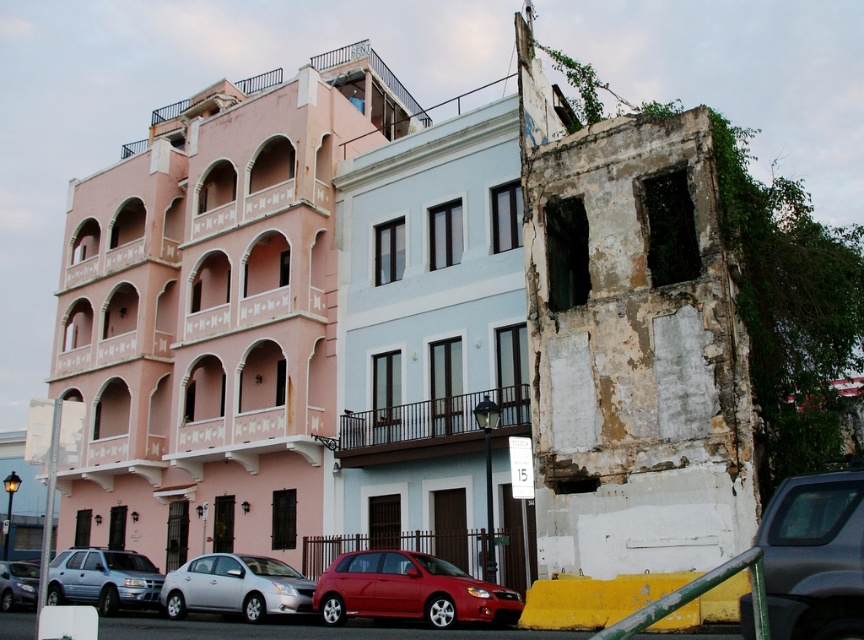
Question: Does silver metallic sedan at lower left appear under metallic silver sedan at lower left?

Choices:
 (A) yes
 (B) no

Answer: (B)

Question: Which object is closer to the camera taking this photo?

Choices:
 (A) metallic gray sedan at lower right
 (B) metallic silver sedan at lower left

Answer: (A)

Question: Is metallic gray sedan at lower right thinner than matte silver suv at lower left?

Choices:
 (A) yes
 (B) no

Answer: (A)

Question: Among these points, which one is nearest to the camera?

Choices:
 (A) (221, 609)
 (B) (420, 609)
 (C) (30, 605)

Answer: (B)

Question: Based on their relative distances, which object is farther from the metallic gray sedan at lower right?

Choices:
 (A) metallic silver sedan at lower left
 (B) silver metallic sedan at lower left

Answer: (A)

Question: Is matte silver suv at lower left bigger than metallic silver sedan at lower left?

Choices:
 (A) yes
 (B) no

Answer: (A)